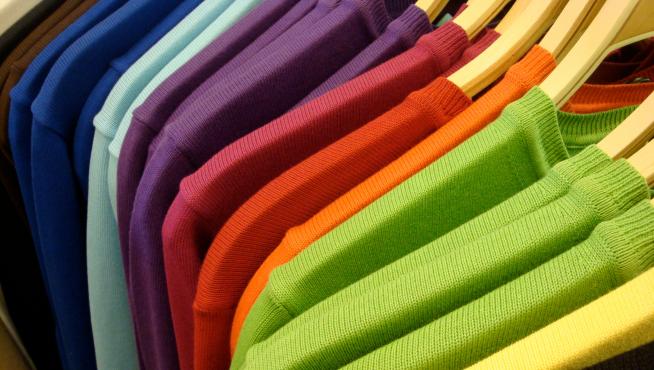
Where is `clothes hangers`? The width and height of the screenshot is (654, 370). clothes hangers is located at coordinates (647, 157), (630, 136), (593, 49), (573, 18), (532, 18), (511, 12), (481, 12), (428, 4), (467, 3).